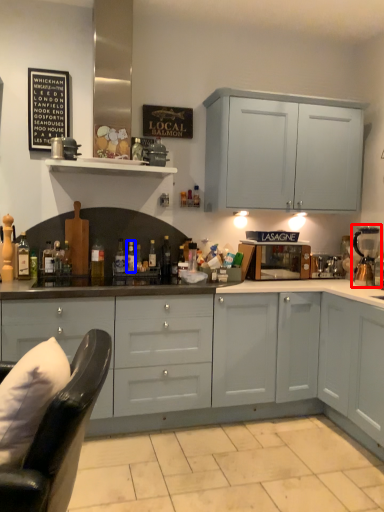
Question: Which object appears closest to the camera in this image, coffee machine (highlighted by a red box) or bottle (highlighted by a blue box)?

Choices:
 (A) coffee machine
 (B) bottle

Answer: (A)